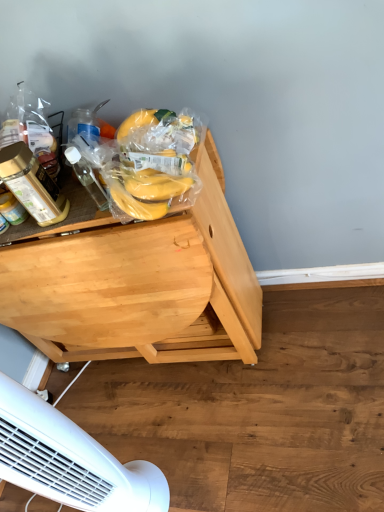
Question: Looking at their shapes, would you say yellow matte bananas at upper left, which is the 1th food from top to bottom, is wider or thinner than translucent plastic bottle at left, the second bottle in the right-to-left sequence?

Choices:
 (A) wide
 (B) thin

Answer: (A)

Question: From a real-world perspective, is yellow matte bananas at upper left, placed as the 2th food when sorted from bottom to top, above or below translucent plastic bottle at left, which appears as the 1th bottle when viewed from the left?

Choices:
 (A) below
 (B) above

Answer: (A)

Question: Which of these objects is positioned closest to the white plastic mechanical fan at lower left?

Choices:
 (A) light wood desk at center
 (B) yellow matte bananas at upper left, which is the 1th food from top to bottom
 (C) yellow matte bananas at center, the 2th food in the top-to-bottom sequence
 (D) transparent plastic bottle at left, which is counted as the 1th bottle, starting from the right
 (E) translucent plastic bottle at left, which appears as the 1th bottle when viewed from the left

Answer: (A)

Question: Which is nearer to the transparent plastic bottle at left, which is counted as the second bottle, starting from the left?

Choices:
 (A) yellow matte bananas at center, which is counted as the 1th food, starting from the bottom
 (B) yellow matte bananas at upper left, placed as the 2th food when sorted from bottom to top
 (C) white plastic mechanical fan at lower left
 (D) light wood desk at center
 (E) translucent plastic bottle at left, which appears as the 1th bottle when viewed from the left

Answer: (E)